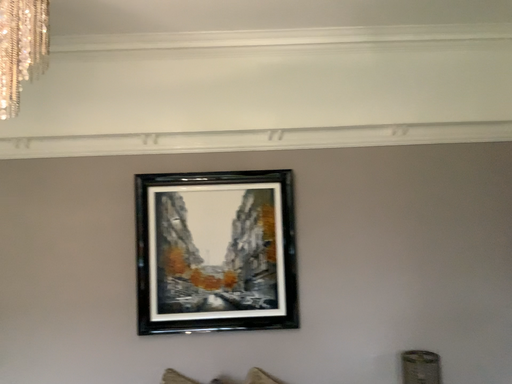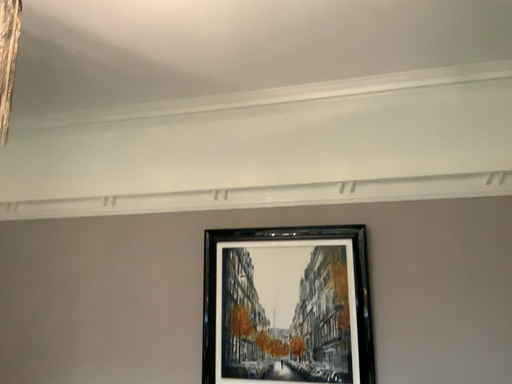
Question: Which way did the camera rotate in the video?

Choices:
 (A) rotated downward
 (B) rotated upward

Answer: (B)